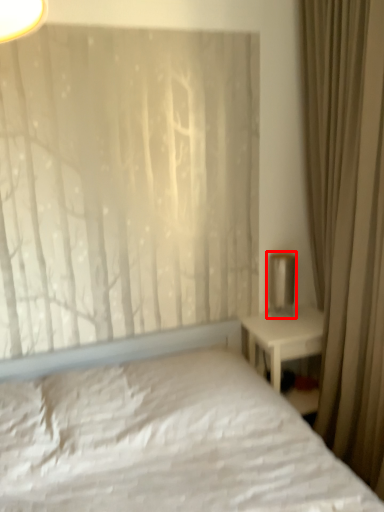
Question: From the image's perspective, where is table lamp (annotated by the red box) located in relation to curtain in the image?

Choices:
 (A) below
 (B) above

Answer: (A)